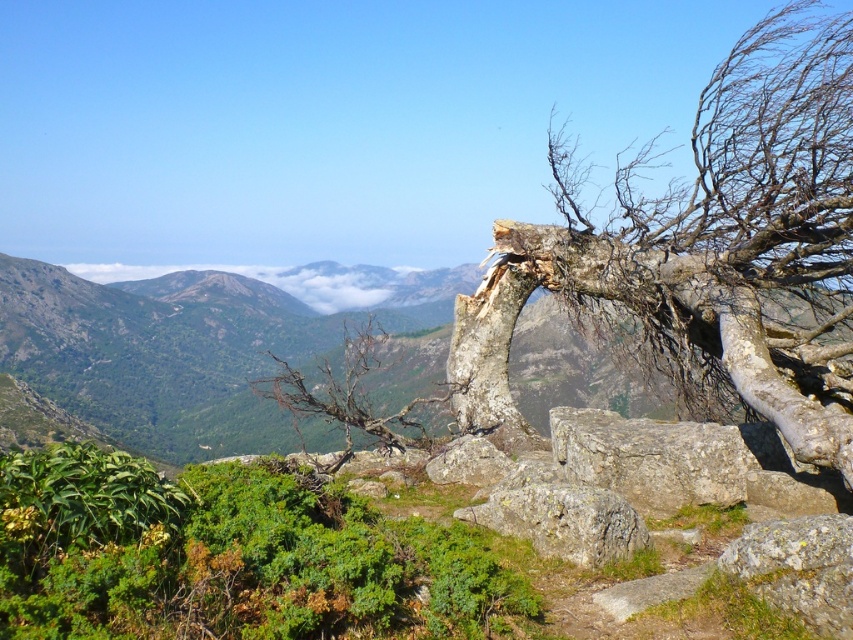
Who is positioned more to the left, gray rough rock at center or white fluffy cloud at center?

white fluffy cloud at center is more to the left.

Is gray rough rock at center bigger than white fluffy cloud at center?

No.

Image resolution: width=853 pixels, height=640 pixels. Identify the location of gray rough rock at center. (563, 520).

Image resolution: width=853 pixels, height=640 pixels. I want to click on gray rough rock at center, so click(563, 520).

Between point (549, 500) and point (412, 401), which one is positioned behind?

The point (412, 401) is behind.

Locate an element on the screen. The image size is (853, 640). gray rough rock at center is located at coordinates (563, 520).

Who is more distant from viewer, (839,218) or (415,282)?

Point (415,282)

From the picture: Who is more forward, (463, 381) or (247, 273)?

Point (463, 381) is more forward.

Which is behind, point (844, 250) or point (273, 275)?

Point (273, 275)

At what (x,y) coordinates should I click in order to perform the action: click on gray rough tree trunk at right. Please return your answer as a coordinate pair (x, y). The height and width of the screenshot is (640, 853). Looking at the image, I should click on (706, 252).